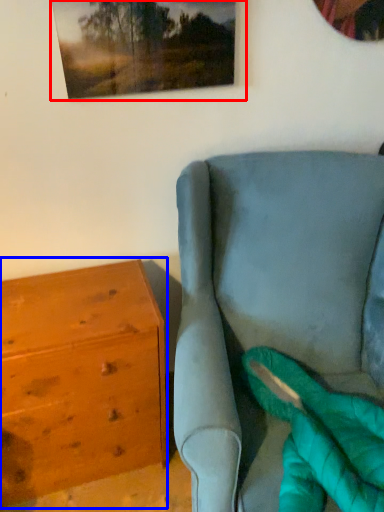
Question: Among these objects, which one is nearest to the camera, picture frame (highlighted by a red box) or chest of drawers (highlighted by a blue box)?

Choices:
 (A) picture frame
 (B) chest of drawers

Answer: (A)